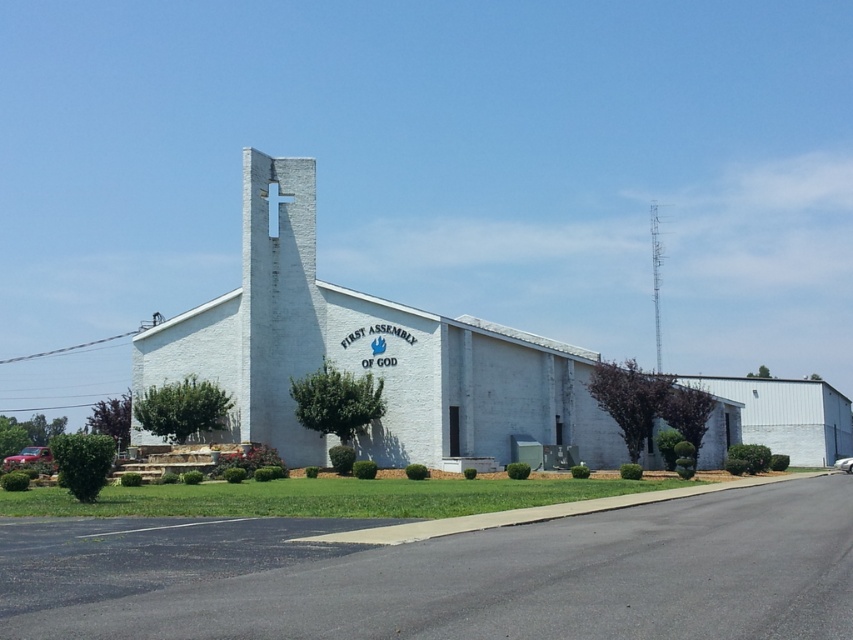
Is white brick chapel at center taller than metallic silver tower at upper right?

No.

Does white brick chapel at center have a lesser height compared to metallic silver tower at upper right?

Yes.

Where is `white brick chapel at center`? white brick chapel at center is located at coordinates (368, 353).